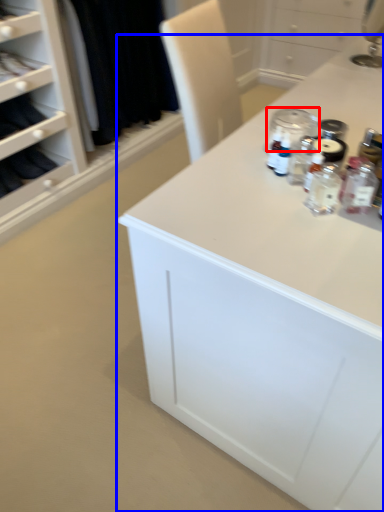
Question: Which object appears farthest to the camera in this image, glass jar (highlighted by a red box) or countertop (highlighted by a blue box)?

Choices:
 (A) glass jar
 (B) countertop

Answer: (A)